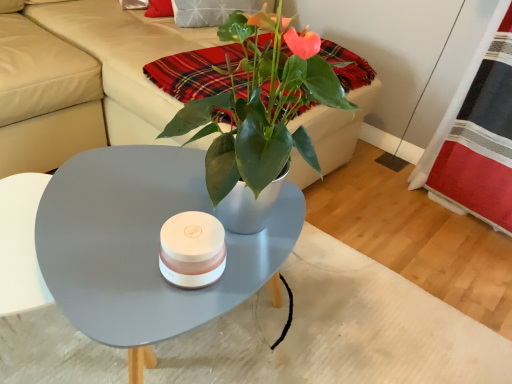
Where is `vacant area to the right of matte gray coffee table at center`? vacant area to the right of matte gray coffee table at center is located at coordinates (366, 298).